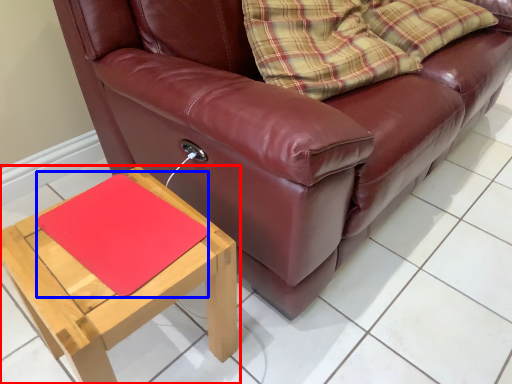
Question: Which object appears closest to the camera in this image, table (highlighted by a red box) or mat (highlighted by a blue box)?

Choices:
 (A) table
 (B) mat

Answer: (A)